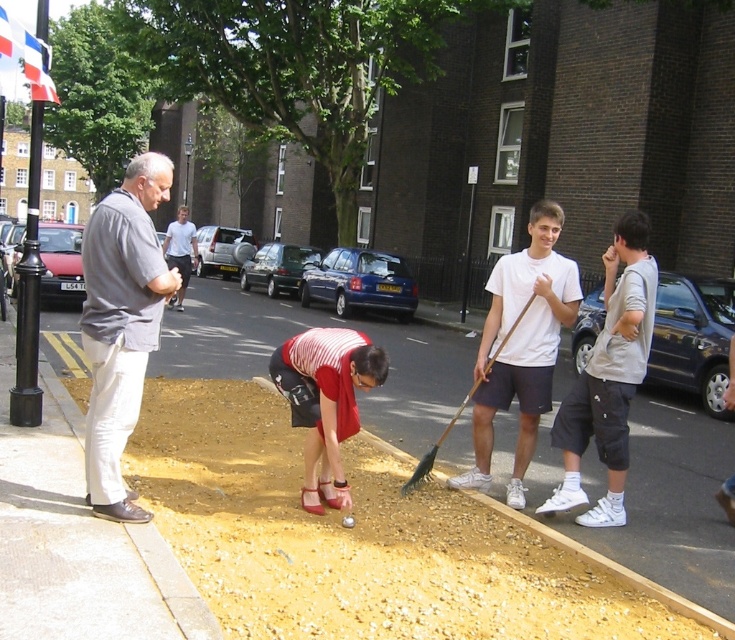
In the scene shown: You are a delivery person who needs to hand a package to the worker in the striped fabric shirt at center. There is a gray cotton shirt at left nearby. Which worker should you approach, and why?

You should approach the striped fabric shirt at center because the gray cotton shirt at left is larger in size, indicating it might belong to a different worker or not the intended recipient.

You are a delivery person trying to navigate through the construction area. There is a striped fabric shirt at center and a wooden shovel at center. Which object should you avoid stepping on to stay clear of the work zone?

You should avoid stepping on the wooden shovel at center because the striped fabric shirt at center is to the left of it, indicating the shovel is in the active work area.

You are a delivery person trying to determine which customer is taller based on their clothing. You see a gray cotton shirt at left and a striped fabric shirt at center. Which one is taller?

The gray cotton shirt at left has a greater height compared to the striped fabric shirt at center, so the customer wearing the gray cotton shirt at left is taller.